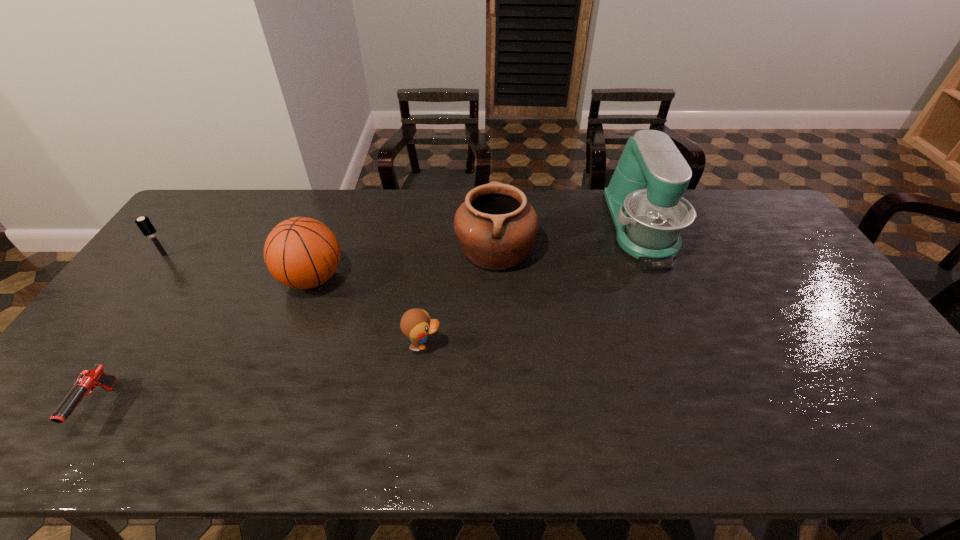
Image resolution: width=960 pixels, height=540 pixels. I want to click on vacant space situated on the right of the fourth object from right to left, so click(416, 279).

At what (x,y) coordinates should I click in order to perform the action: click on blank area located 0.140m on the back of the fifth object from left to right. Please return your answer as a coordinate pair (x, y). Looking at the image, I should click on (493, 201).

The image size is (960, 540). I want to click on vacant space located on the front of the hairbrush, so click(x=130, y=302).

The image size is (960, 540). I want to click on free location located 0.150m on the front-facing side of the fifth tallest object, so click(498, 345).

At what (x,y) coordinates should I click in order to perform the action: click on mixer positioned at the far edge. Please return your answer as a coordinate pair (x, y). This screenshot has width=960, height=540. Looking at the image, I should click on (644, 197).

This screenshot has width=960, height=540. What are the coordinates of `pottery that is at the far edge` in the screenshot? It's located at (496, 227).

At what (x,y) coordinates should I click in order to perform the action: click on object that is at the near edge. Please return your answer as a coordinate pair (x, y). Looking at the image, I should click on (88, 380).

Image resolution: width=960 pixels, height=540 pixels. Identify the location of hairbrush at the left edge. (144, 224).

Identify the location of gun that is at the left edge. (88, 380).

Locate an element on the screen. This screenshot has width=960, height=540. object at the near left corner is located at coordinates 88,380.